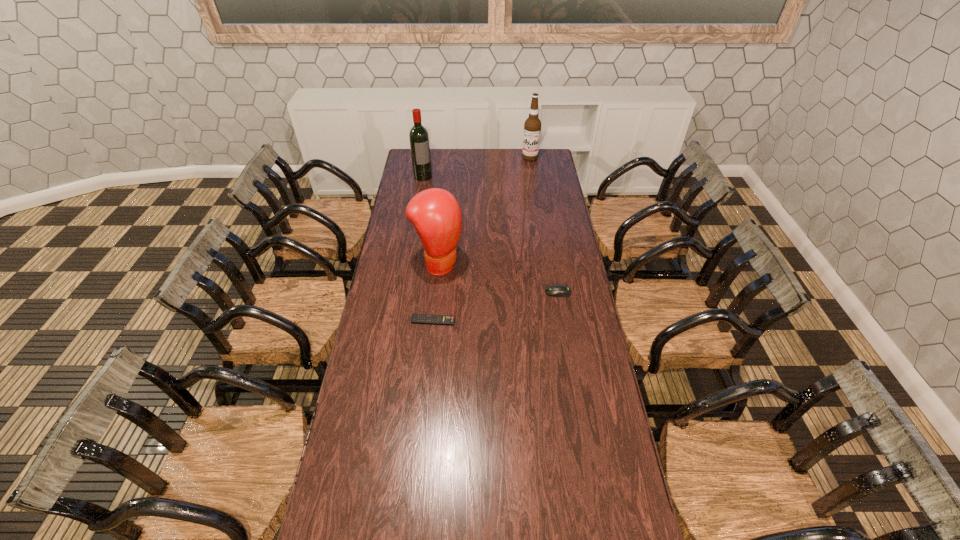
In order to click on vacant space on the desktop that is between the nearest object and the fourth tallest object and is positioned on the label of the wine bottle in this screenshot , I will do `click(498, 306)`.

Identify the location of free space on the desktop that is between the nearest object and the fourth tallest object and is positioned on the striking surface of the third nearest object. (506, 304).

At what (x,y) coordinates should I click in order to perform the action: click on vacant space on the desktop that is between the shortest object and the fourth tallest object and is positioned on the label of the farthest object. Please return your answer as a coordinate pair (x, y). Looking at the image, I should click on (490, 308).